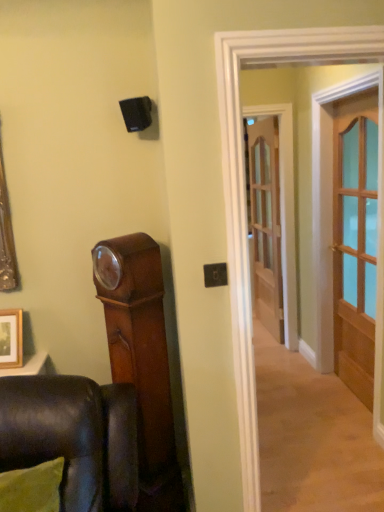
Question: Considering the relative sizes of clear glass door at center, which is counted as the first door, starting from the back, and light brown wooden door at right, positioned as the second door in back-to-front order, in the image provided, is clear glass door at center, which is counted as the first door, starting from the back, wider than light brown wooden door at right, positioned as the second door in back-to-front order,?

Choices:
 (A) yes
 (B) no

Answer: (B)

Question: Can you confirm if clear glass door at center, the 1th door when ordered from left to right, is positioned to the right of light brown wooden door at right, positioned as the second door in back-to-front order?

Choices:
 (A) no
 (B) yes

Answer: (A)

Question: Is clear glass door at center, which is counted as the second door, starting from the front, thinner than light brown wooden door at right, which is counted as the second door, starting from the left?

Choices:
 (A) no
 (B) yes

Answer: (B)

Question: Is clear glass door at center, which is counted as the second door, starting from the front, far from light brown wooden door at right, which appears as the first door when viewed from the right?

Choices:
 (A) yes
 (B) no

Answer: (A)

Question: Can you confirm if clear glass door at center, which is counted as the second door, starting from the front, is taller than light brown wooden door at right, which appears as the first door when viewed from the right?

Choices:
 (A) yes
 (B) no

Answer: (B)

Question: Relative to wooden picture frame at lower left, is light brown wooden door at right, which is counted as the second door, starting from the left, in front or behind?

Choices:
 (A) front
 (B) behind

Answer: (B)

Question: Visually, is light brown wooden door at right, which is the first door in front-to-back order, positioned to the left or to the right of wooden picture frame at lower left?

Choices:
 (A) left
 (B) right

Answer: (B)

Question: Is light brown wooden door at right, which appears as the first door when viewed from the right, bigger or smaller than wooden picture frame at lower left?

Choices:
 (A) big
 (B) small

Answer: (A)

Question: Does point (359, 169) appear closer or farther from the camera than point (4, 362)?

Choices:
 (A) closer
 (B) farther

Answer: (B)

Question: Visually, is light brown wooden door at right, which is counted as the second door, starting from the left, positioned to the left or to the right of clear glass door at center, the 1th door when ordered from left to right?

Choices:
 (A) left
 (B) right

Answer: (B)

Question: Considering the positions of point (355, 385) and point (269, 245), is point (355, 385) closer or farther from the camera than point (269, 245)?

Choices:
 (A) closer
 (B) farther

Answer: (A)

Question: Considering the positions of light brown wooden door at right, which appears as the first door when viewed from the right, and clear glass door at center, which is counted as the second door, starting from the front, in the image, is light brown wooden door at right, which appears as the first door when viewed from the right, wider or thinner than clear glass door at center, which is counted as the second door, starting from the front,?

Choices:
 (A) thin
 (B) wide

Answer: (B)

Question: From a real-world perspective, relative to clear glass door at center, which is counted as the second door, starting from the front, is light brown wooden door at right, which is the first door in front-to-back order, vertically above or below?

Choices:
 (A) below
 (B) above

Answer: (B)

Question: From the image's perspective, relative to wooden picture frame at lower left, is clear glass door at center, the 1th door when ordered from left to right, above or below?

Choices:
 (A) below
 (B) above

Answer: (B)

Question: Considering the positions of clear glass door at center, which is counted as the second door, starting from the front, and wooden picture frame at lower left in the image, is clear glass door at center, which is counted as the second door, starting from the front, bigger or smaller than wooden picture frame at lower left?

Choices:
 (A) small
 (B) big

Answer: (B)